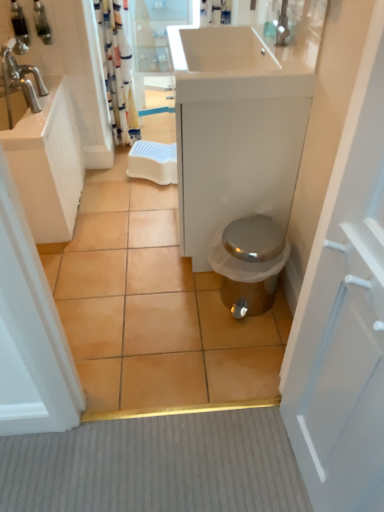
Describe the element at coordinates (238, 125) in the screenshot. I see `white glossy cabinet at center` at that location.

From the picture: What is the approximate width of white glossy cabinet at center?

It is 17.88 inches.

At what (x,y) coordinates should I click in order to perform the action: click on white glossy door at right. Please return your answer as a coordinate pair (x, y). Image resolution: width=384 pixels, height=512 pixels. Looking at the image, I should click on (344, 316).

The width and height of the screenshot is (384, 512). What are the coordinates of `brushed metal soap dispenser at upper left, acting as the 1th toiletry starting from the left` in the screenshot? It's located at (19, 23).

You are a GUI agent. You are given a task and a screenshot of the screen. Output one action in this format:
    pyautogui.click(x=<x>, y=<y>)
    Task: Click on the brown ceramic tile at center
    This screenshot has width=384, height=512.
    Given the screenshot: What is the action you would take?
    pyautogui.click(x=153, y=307)

Locate an element on the screen. The image size is (384, 512). white glossy sink at upper center is located at coordinates (247, 59).

Find the location of a particular element. transparent glass door at upper center is located at coordinates (156, 40).

Which of these two, translucent plastic soap dispenser at upper left, the first toiletry positioned from the right, or white glossy sink at upper left, stands shorter?

With less height is translucent plastic soap dispenser at upper left, the first toiletry positioned from the right.

Considering the relative positions of translucent plastic soap dispenser at upper left, the first toiletry positioned from the right, and white glossy sink at upper left in the image provided, is translucent plastic soap dispenser at upper left, the first toiletry positioned from the right, behind white glossy sink at upper left?

Yes, it is.

Considering the sizes of translucent plastic soap dispenser at upper left, which is counted as the second toiletry, starting from the left, and white glossy sink at upper left in the image, is translucent plastic soap dispenser at upper left, which is counted as the second toiletry, starting from the left, wider or thinner than white glossy sink at upper left?

Considering their sizes, translucent plastic soap dispenser at upper left, which is counted as the second toiletry, starting from the left, looks slimmer than white glossy sink at upper left.

Is silver metallic toilet at center bigger than brown ceramic tile at center?

No.

From a real-world perspective, which object rests below the other?

brown ceramic tile at center, from a real-world perspective.

Is silver metallic toilet at center positioned with its back to brown ceramic tile at center?

silver metallic toilet at center is not turned away from brown ceramic tile at center.

Is silver metallic toilet at center touching brown ceramic tile at center?

No, silver metallic toilet at center is not in contact with brown ceramic tile at center.

Which is in front, white glossy sink at upper left or white glossy cabinet at center?

white glossy cabinet at center is closer to the camera.

Is white glossy sink at upper left positioned far away from white glossy cabinet at center?

That's not correct — white glossy sink at upper left is a little close to white glossy cabinet at center.

Can you confirm if white glossy sink at upper left is shorter than white glossy cabinet at center?

Indeed, white glossy sink at upper left has a lesser height compared to white glossy cabinet at center.

Is white glossy sink at upper left facing towards white glossy cabinet at center?

No, white glossy sink at upper left does not turn towards white glossy cabinet at center.

Is the surface of brushed metal soap dispenser at upper left, the 2th toiletry when ordered from right to left, in direct contact with white glossy sink at upper left?

No.

Which of these two, brushed metal soap dispenser at upper left, the 2th toiletry when ordered from right to left, or white glossy sink at upper left, is bigger?

With larger size is white glossy sink at upper left.

Considering the positions of point (18, 21) and point (27, 135), is point (18, 21) closer or farther from the camera than point (27, 135)?

Point (18, 21) is positioned farther from the camera compared to point (27, 135).

From a real-world perspective, is white glossy sink at upper center physically below white glossy sink at upper left?

No, from a real-world perspective, white glossy sink at upper center is not below white glossy sink at upper left.

Is white glossy sink at upper center placed right next to white glossy sink at upper left?

No, white glossy sink at upper center is not beside white glossy sink at upper left.

Is the depth of white glossy sink at upper center less than that of white glossy sink at upper left?

Yes, white glossy sink at upper center is closer to the camera.

Which point is more distant from viewer, (109, 55) or (24, 42)?

Positioned behind is point (109, 55).

Does striped fabric shower curtain at upper left have a lesser width compared to brushed metal soap dispenser at upper left, acting as the 1th toiletry starting from the left?

Incorrect, the width of striped fabric shower curtain at upper left is not less than that of brushed metal soap dispenser at upper left, acting as the 1th toiletry starting from the left.

Measure the distance between striped fabric shower curtain at upper left and brushed metal soap dispenser at upper left, the 2th toiletry when ordered from right to left.

They are 23.65 inches apart.

How many degrees apart are the facing directions of striped fabric shower curtain at upper left and brushed metal soap dispenser at upper left, acting as the 1th toiletry starting from the left?

0.758 degrees separate the facing orientations of striped fabric shower curtain at upper left and brushed metal soap dispenser at upper left, acting as the 1th toiletry starting from the left.

Is brown ceramic tile at center facing away from white glossy sink at upper center?

No, brown ceramic tile at center's orientation is not away from white glossy sink at upper center.

Looking at this image, how much distance is there between brown ceramic tile at center and white glossy sink at upper center?

86.25 centimeters.

Does brown ceramic tile at center have a greater height compared to white glossy sink at upper center?

Incorrect, the height of brown ceramic tile at center is not larger of that of white glossy sink at upper center.

Would you consider brown ceramic tile at center to be distant from white glossy sink at upper center?

They are positioned close to each other.

The width and height of the screenshot is (384, 512). I want to click on counter top lying below the translucent plastic soap dispenser at upper left, the first toiletry positioned from the right (from the image's perspective), so click(x=35, y=120).

I want to click on ceramic tile on the left of silver metallic toilet at center, so click(153, 307).

From the image, which object appears to be nearer to white glossy door at right, white glossy cabinet at center or striped fabric shower curtain at upper left?

white glossy cabinet at center is closer to white glossy door at right.

Considering their positions, is silver metallic toilet at center positioned closer to translucent plastic soap dispenser at upper left, the first toiletry positioned from the right, than transparent glass door at upper center?

transparent glass door at upper center lies closer to translucent plastic soap dispenser at upper left, the first toiletry positioned from the right, than the other object.

From the image, which object appears to be farther from white glossy cabinet at center, silver metallic toilet at center or striped fabric shower curtain at upper left?

striped fabric shower curtain at upper left is positioned further to the anchor white glossy cabinet at center.

Estimate the real-world distances between objects in this image. Which object is closer to striped fabric shower curtain at upper left, white glossy cabinet at center or white glossy door at right?

white glossy cabinet at center lies closer to striped fabric shower curtain at upper left than the other object.

Estimate the real-world distances between objects in this image. Which object is further from brown ceramic tile at center, white glossy door at right or white glossy sink at upper left?

white glossy sink at upper left.

Considering their positions, is silver metallic toilet at center positioned closer to white glossy door at right than white glossy cabinet at center?

Based on the image, silver metallic toilet at center appears to be nearer to white glossy door at right.

Looking at this image, estimate the real-world distances between objects in this image. Which object is closer to brushed metal soap dispenser at upper left, the 2th toiletry when ordered from right to left, transparent glass door at upper center or white glossy door at right?

Based on the image, transparent glass door at upper center appears to be nearer to brushed metal soap dispenser at upper left, the 2th toiletry when ordered from right to left.

Looking at the image, which one is located further to brushed metal soap dispenser at upper left, acting as the 1th toiletry starting from the left, striped fabric shower curtain at upper left or silver metallic toilet at center?

Based on the image, silver metallic toilet at center appears to be further to brushed metal soap dispenser at upper left, acting as the 1th toiletry starting from the left.

I want to click on counter top between brushed metal soap dispenser at upper left, the 2th toiletry when ordered from right to left, and silver metallic toilet at center, in the horizontal direction, so click(x=35, y=120).

Where is `sink positioned between white glossy door at right and white glossy cabinet at center from near to far`? The width and height of the screenshot is (384, 512). sink positioned between white glossy door at right and white glossy cabinet at center from near to far is located at coordinates (247, 59).

Identify the location of bathroom cabinet between translucent plastic soap dispenser at upper left, the first toiletry positioned from the right, and brown ceramic tile at center from top to bottom. This screenshot has height=512, width=384. (238, 125).

This screenshot has height=512, width=384. What are the coordinates of `toiletry between brushed metal soap dispenser at upper left, the 2th toiletry when ordered from right to left, and white glossy cabinet at center from left to right` in the screenshot? It's located at (42, 23).